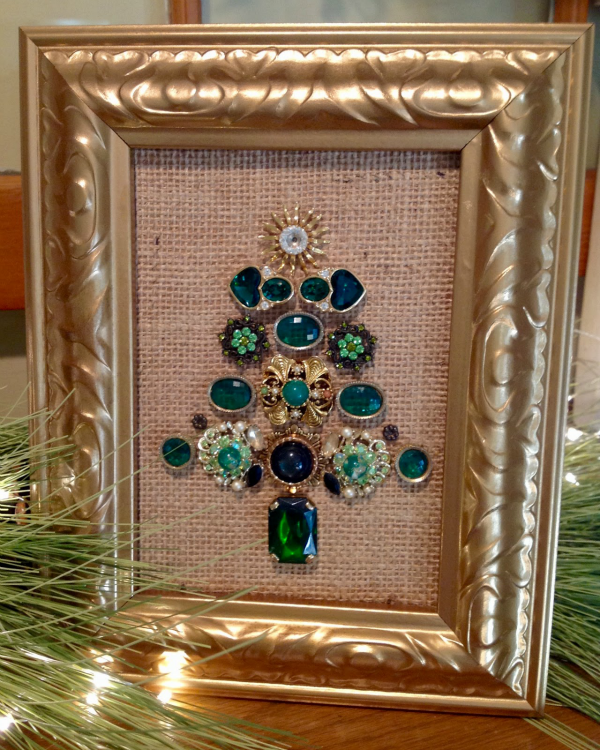
You are a GUI agent. You are given a task and a screenshot of the screen. Output one action in this format:
    pyautogui.click(x=<x>, y=<y>)
    Task: Click on the beige hessian fabric
    This screenshot has height=750, width=600.
    Given the screenshot: What is the action you would take?
    pyautogui.click(x=195, y=205)